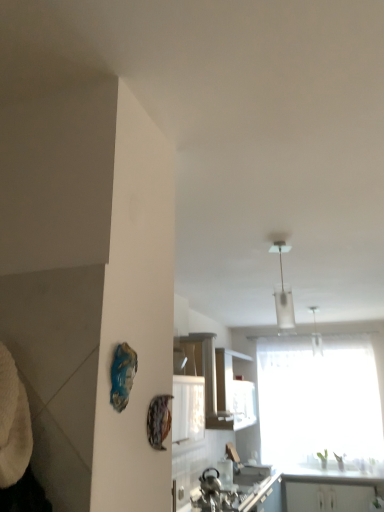
Question: Does transparent fabric window at center have a lesser width compared to white glossy cabinet at center, which appears as the second cabinetry when ordered from the bottom?

Choices:
 (A) no
 (B) yes

Answer: (B)

Question: Does transparent fabric window at center contain white glossy cabinet at center, which is the second cabinetry in right-to-left order?

Choices:
 (A) no
 (B) yes

Answer: (A)

Question: Is transparent fabric window at center facing away from white glossy cabinet at center, the first cabinetry from the front?

Choices:
 (A) no
 (B) yes

Answer: (A)

Question: From the image's perspective, is transparent fabric window at center below white glossy cabinet at center, which appears as the second cabinetry when ordered from the bottom?

Choices:
 (A) yes
 (B) no

Answer: (A)

Question: Does transparent fabric window at center appear on the left side of white glossy cabinet at center, the first cabinetry from the front?

Choices:
 (A) no
 (B) yes

Answer: (A)

Question: Considering the positions of metallic silver sink at lower center and white glass pendant light at upper center in the image, is metallic silver sink at lower center wider or thinner than white glass pendant light at upper center?

Choices:
 (A) wide
 (B) thin

Answer: (A)

Question: Looking at the image, does metallic silver sink at lower center seem bigger or smaller compared to white glass pendant light at upper center?

Choices:
 (A) big
 (B) small

Answer: (A)

Question: Relative to white glass pendant light at upper center, is metallic silver sink at lower center in front or behind?

Choices:
 (A) behind
 (B) front

Answer: (A)

Question: Would you say metallic silver sink at lower center is to the left or to the right of white glass pendant light at upper center in the picture?

Choices:
 (A) left
 (B) right

Answer: (B)

Question: Is point (228, 420) positioned closer to the camera than point (228, 471)?

Choices:
 (A) farther
 (B) closer

Answer: (B)

Question: Is white glossy cabinet at center, which is counted as the first cabinetry, starting from the left, to the left or to the right of metallic silver sink at lower center in the image?

Choices:
 (A) right
 (B) left

Answer: (B)

Question: Would you say white glossy cabinet at center, arranged as the first cabinetry when viewed from the top, is inside or outside metallic silver sink at lower center?

Choices:
 (A) outside
 (B) inside

Answer: (A)

Question: From the image's perspective, is white glossy cabinet at center, which ranks as the 2th cabinetry in back-to-front order, located above or below metallic silver sink at lower center?

Choices:
 (A) above
 (B) below

Answer: (A)

Question: From a real-world perspective, is white glossy cabinet at lower right, placed as the second cabinetry when sorted from top to bottom, above or below metallic silver sink at lower center?

Choices:
 (A) above
 (B) below

Answer: (B)

Question: Is white glossy cabinet at lower right, the 1th cabinetry positioned from the back, inside the boundaries of metallic silver sink at lower center, or outside?

Choices:
 (A) outside
 (B) inside

Answer: (A)